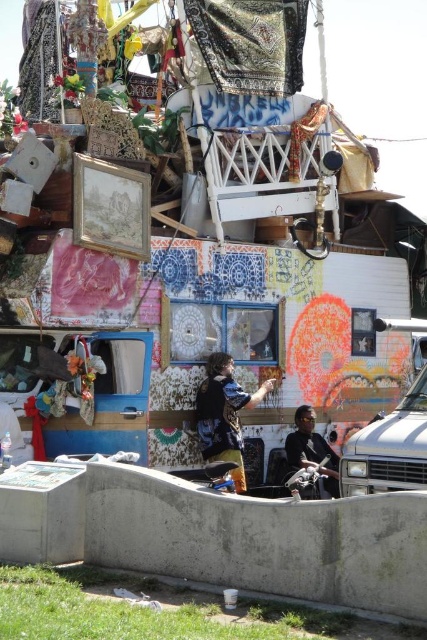
Question: Does white painted truck at center lie in front of flannel shirt at center?

Choices:
 (A) no
 (B) yes

Answer: (B)

Question: Considering the real-world distances, which object is closest to the flannel shirt at center?

Choices:
 (A) white matte truck at right
 (B) white painted truck at center

Answer: (B)

Question: Is white painted truck at center positioned in front of dark blue shirt at center?

Choices:
 (A) yes
 (B) no

Answer: (A)

Question: Does white painted truck at center appear over dark blue shirt at center?

Choices:
 (A) no
 (B) yes

Answer: (B)

Question: Considering the real-world distances, which object is farthest from the white matte truck at right?

Choices:
 (A) flannel shirt at center
 (B) dark blue shirt at center

Answer: (B)

Question: Which of the following is the closest to the observer?

Choices:
 (A) (412, 417)
 (B) (271, 394)
 (C) (307, 428)

Answer: (A)